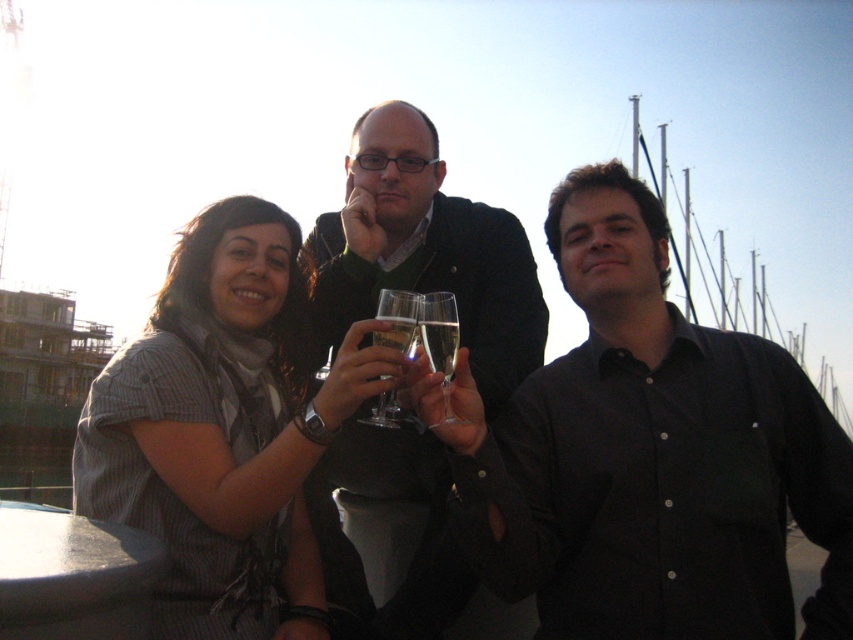
Is point (607, 332) closer to viewer compared to point (448, 620)?

No, (607, 332) is further to viewer.

Does black shirt at center have a smaller size compared to matte black sweater at center?

No.

Based on the photo, who is more distant from viewer, (663, 216) or (360, 266)?

Point (360, 266)

You are a GUI agent. You are given a task and a screenshot of the screen. Output one action in this format:
    pyautogui.click(x=<x>, y=<y>)
    Task: Click on the black shirt at center
    
    Given the screenshot: What is the action you would take?
    pyautogui.click(x=650, y=456)

Which is behind, point (654, 300) or point (450, 328)?

The point (654, 300) is behind.

Can you confirm if black shirt at center is shorter than clear glass champagne flute at center?

In fact, black shirt at center may be taller than clear glass champagne flute at center.

Who is more distant from viewer, (x=567, y=381) or (x=451, y=337)?

The point (x=567, y=381) is behind.

Where is `black shirt at center`? The width and height of the screenshot is (853, 640). black shirt at center is located at coordinates (650, 456).

Between striped fabric shirt at center and matte black sweater at center, which one appears on the left side from the viewer's perspective?

striped fabric shirt at center

Measure the distance between striped fabric shirt at center and camera.

The distance of striped fabric shirt at center from camera is 119.29 feet.

Between point (312, 448) and point (444, 477), which one is positioned behind?

The point (444, 477) is more distant.

This screenshot has width=853, height=640. Identify the location of striped fabric shirt at center. (223, 429).